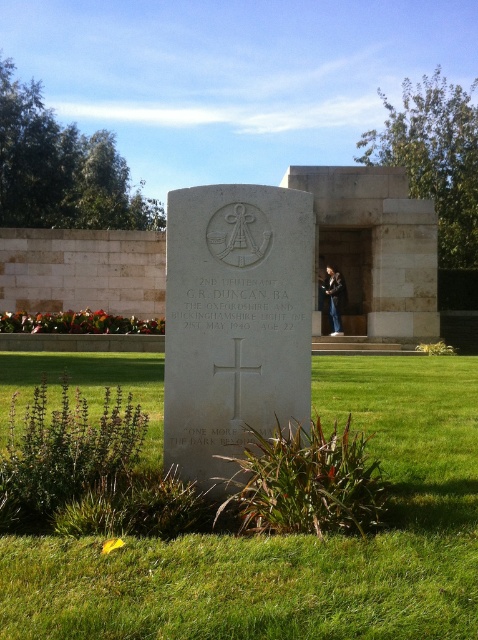
Which is in front, point (127, 620) or point (341, 304)?

Point (127, 620)

Is green grass at center positioned at the back of black leather jacket at center?

No, green grass at center is in front of black leather jacket at center.

Which is in front, point (458, 388) or point (328, 312)?

Positioned in front is point (458, 388).

I want to click on green grass at center, so click(293, 540).

Does green grass at center have a greater width compared to white stone cross at center?

Indeed, green grass at center has a greater width compared to white stone cross at center.

Is green grass at center thinner than white stone cross at center?

Incorrect, green grass at center's width is not less than white stone cross at center's.

Which is behind, point (378, 602) or point (177, 253)?

Positioned behind is point (177, 253).

I want to click on green grass at center, so click(293, 540).

Who is positioned more to the right, white stone cross at center or black leather jacket at center?

From the viewer's perspective, black leather jacket at center appears more on the right side.

Which of these two, white stone cross at center or black leather jacket at center, stands shorter?

With less height is white stone cross at center.

Is point (220, 276) positioned in front of point (338, 289)?

Yes, point (220, 276) is in front of point (338, 289).

This screenshot has width=478, height=640. In order to click on white stone cross at center in this screenshot , I will do `click(235, 321)`.